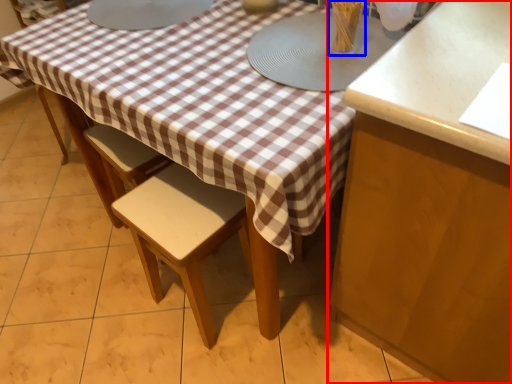
Question: Among these objects, which one is nearest to the camera, cabinetry (highlighted by a red box) or tableware (highlighted by a blue box)?

Choices:
 (A) cabinetry
 (B) tableware

Answer: (A)